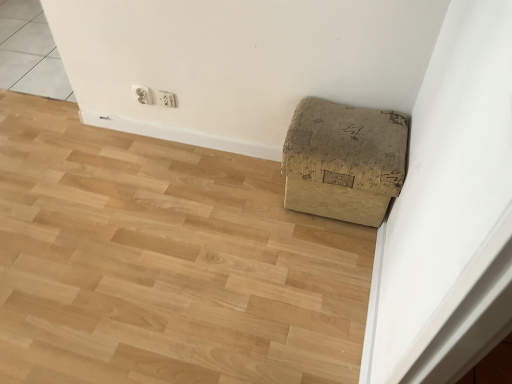
Image resolution: width=512 pixels, height=384 pixels. In order to click on free location to the left of brown cardboard box at lower right in this screenshot , I will do `click(249, 204)`.